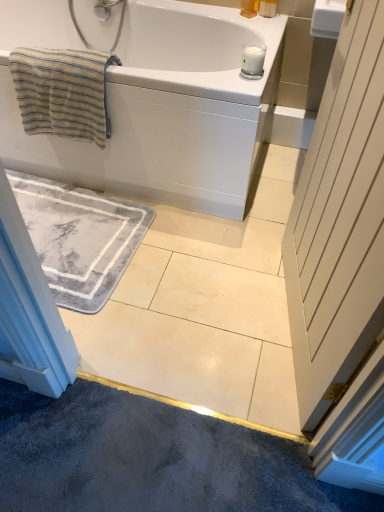
Question: Considering the relative sizes of beige striped towel at upper left and matte yellow soap at upper center, the second toiletry viewed from the right, in the image provided, is beige striped towel at upper left thinner than matte yellow soap at upper center, the second toiletry viewed from the right,?

Choices:
 (A) no
 (B) yes

Answer: (A)

Question: Does beige striped towel at upper left contain matte yellow soap at upper center, acting as the first toiletry starting from the left?

Choices:
 (A) no
 (B) yes

Answer: (A)

Question: Is beige striped towel at upper left with matte yellow soap at upper center, the second toiletry viewed from the right?

Choices:
 (A) no
 (B) yes

Answer: (A)

Question: From a real-world perspective, is beige striped towel at upper left physically above matte yellow soap at upper center, the second toiletry viewed from the right?

Choices:
 (A) no
 (B) yes

Answer: (A)

Question: From the image's perspective, does beige striped towel at upper left appear lower than matte yellow soap at upper center, acting as the first toiletry starting from the left?

Choices:
 (A) no
 (B) yes

Answer: (B)

Question: Is beige striped towel at upper left aimed at matte yellow soap at upper center, acting as the first toiletry starting from the left?

Choices:
 (A) no
 (B) yes

Answer: (A)

Question: Does matte yellow soap at upper center, the second toiletry viewed from the right, lie in front of white wooden door at right?

Choices:
 (A) no
 (B) yes

Answer: (A)

Question: Can you confirm if matte yellow soap at upper center, the second toiletry viewed from the right, is taller than white wooden door at right?

Choices:
 (A) no
 (B) yes

Answer: (A)

Question: Considering the relative sizes of matte yellow soap at upper center, the second toiletry viewed from the right, and white wooden door at right in the image provided, is matte yellow soap at upper center, the second toiletry viewed from the right, shorter than white wooden door at right?

Choices:
 (A) no
 (B) yes

Answer: (B)

Question: Does matte yellow soap at upper center, acting as the first toiletry starting from the left, appear on the right side of white wooden door at right?

Choices:
 (A) yes
 (B) no

Answer: (B)

Question: Does matte yellow soap at upper center, the second toiletry viewed from the right, contain white wooden door at right?

Choices:
 (A) no
 (B) yes

Answer: (A)

Question: Is matte yellow soap at upper center, acting as the first toiletry starting from the left, further to the viewer compared to white wooden door at right?

Choices:
 (A) yes
 (B) no

Answer: (A)

Question: Is beige striped towel at upper left directly adjacent to matte plastic soap at upper right, the second toiletry in the left-to-right sequence?

Choices:
 (A) no
 (B) yes

Answer: (A)